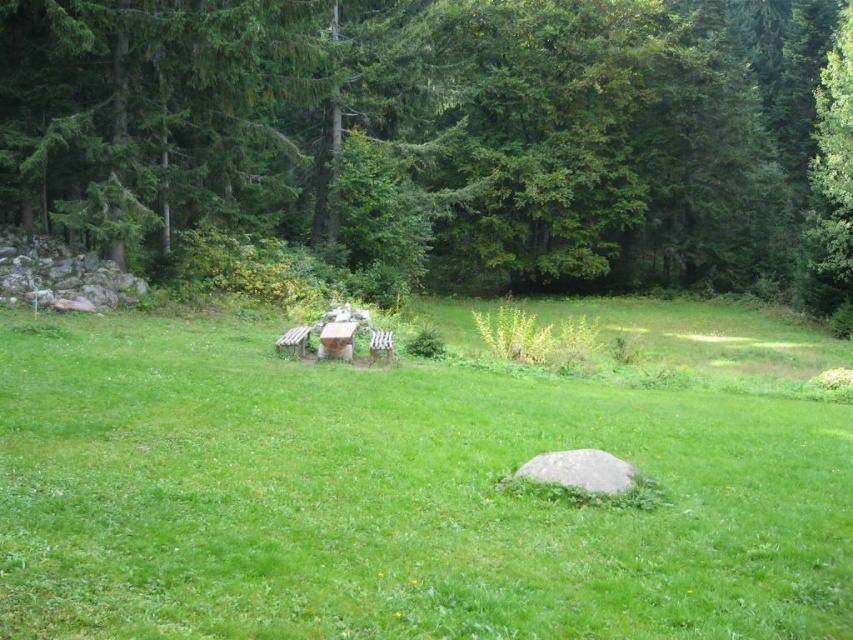
You are planning to set up a small tent in the green grassy field at center. Considering the height of the green leafy tree at upper center, will the tree block sunlight from reaching your tent during the day?

The green leafy tree at upper center is taller than the green grassy field at center, so it may cast shadows over the tent depending on the time of day and the tree canopy density.

You are standing in the park and want to walk towards the green leafy tree at upper center. Which direction should you move relative to the green grassy field at center?

You should move to the right relative to the green grassy field at center because the green grassy field at center is to the left of the green leafy tree at upper center, meaning the tree is on the right side of the field.